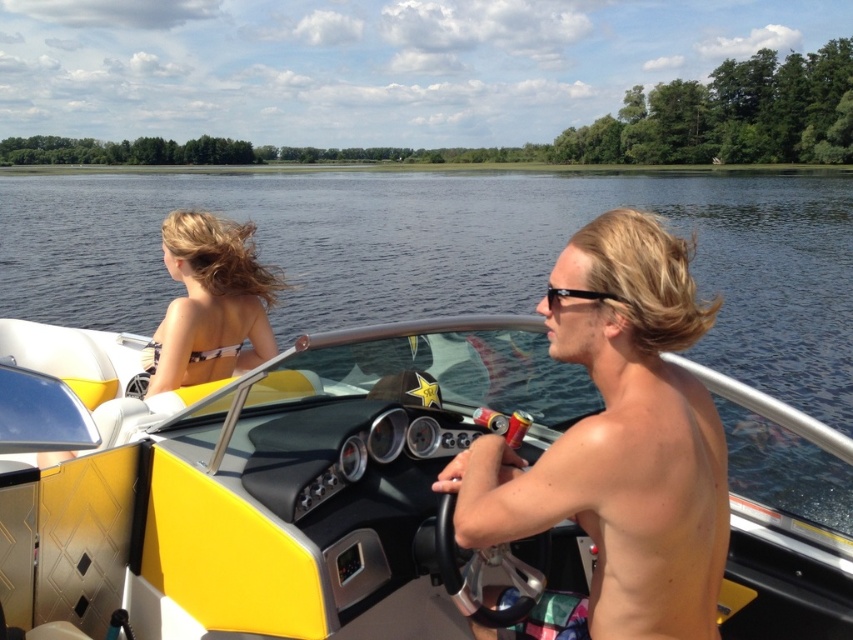
Question: Where is transparent water at center located in relation to black plastic sunglasses at center in the image?

Choices:
 (A) below
 (B) above

Answer: (B)

Question: Which point is farther from the camera taking this photo?

Choices:
 (A) (271, 429)
 (B) (593, 291)
 (C) (222, 314)

Answer: (C)

Question: Is skinny tan skin at center positioned at the back of black plastic sunglasses at center?

Choices:
 (A) no
 (B) yes

Answer: (A)

Question: Which object is closer to the camera taking this photo?

Choices:
 (A) yellow matte boat at center
 (B) shiny blonde hair at center
 (C) transparent water at center
 (D) black bikini top at left

Answer: (B)

Question: Which object appears farthest from the camera in this image?

Choices:
 (A) black bikini top at left
 (B) skinny tan skin at center
 (C) transparent water at center

Answer: (A)

Question: Can you confirm if skinny tan skin at center is wider than black plastic sunglasses at center?

Choices:
 (A) yes
 (B) no

Answer: (A)